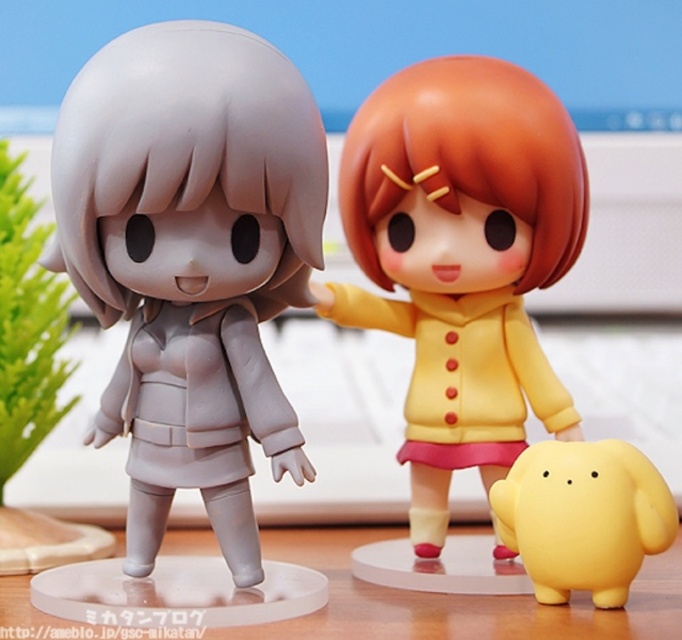
You are looking at two points on the wooden surface where the figurines are placed. Which point is closer to you, point (346, 300) or point (621, 467)?

Point (346, 300) is closer to you because it is further to the viewer than point (621, 467).

You are organizing a display on a shelf and need to arrange the matte yellow plush at center and the yellow matte plush at lower right. Based on their positions in the image, which one should you place higher up on the shelf to match the original arrangement?

The matte yellow plush at center should be placed higher up on the shelf because it is positioned above the yellow matte plush at lower right in the image.

You are organizing a display and need to place a small vase between the matte gray figurine at left and the yellow matte plush at lower right. Which object should the vase be closer to if it needs to be placed at the same height as the shorter object?

The vase should be placed closer to the yellow matte plush at lower right because the yellow matte plush at lower right is shorter than the matte gray figurine at left, so placing the vase at its height would require positioning it near the yellow matte plush at lower right.